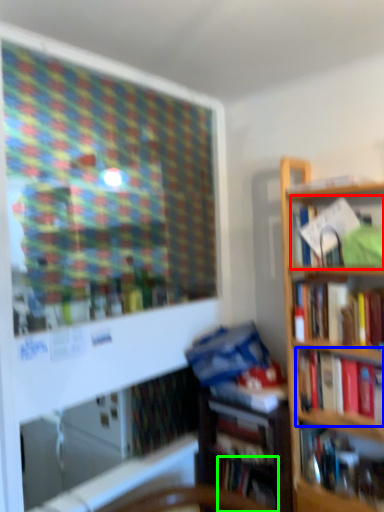
Question: Estimate the real-world distances between objects in this image. Which object is closer to book (highlighted by a red box), book (highlighted by a blue box) or book (highlighted by a green box)?

Choices:
 (A) book
 (B) book

Answer: (A)